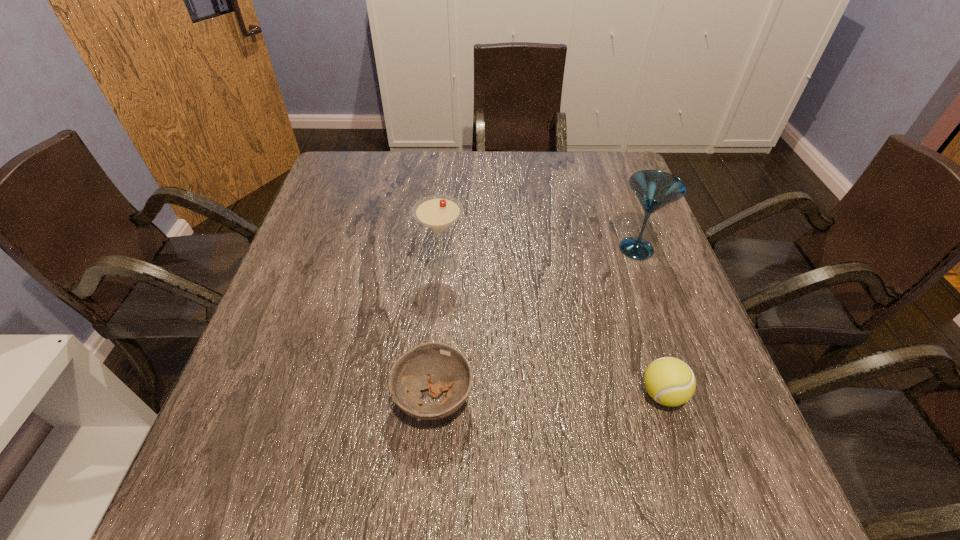
I want to click on free location at the far edge, so click(461, 164).

Where is `free space at the left edge of the desktop`? The height and width of the screenshot is (540, 960). free space at the left edge of the desktop is located at coordinates (324, 205).

You are a GUI agent. You are given a task and a screenshot of the screen. Output one action in this format:
    pyautogui.click(x=<x>, y=<y>)
    Task: Click on the vacant point at the right edge
    This screenshot has width=960, height=540.
    Given the screenshot: What is the action you would take?
    pyautogui.click(x=610, y=205)

At what (x,y) coordinates should I click in order to perform the action: click on vacant space at the far right corner. Please return your answer as a coordinate pair (x, y). This screenshot has width=960, height=540. Looking at the image, I should click on click(597, 154).

What are the coordinates of `vacant area that lies between the right martini and the shortest object` in the screenshot? It's located at (535, 323).

Where is `free space between the third tallest object and the left martini`? This screenshot has width=960, height=540. free space between the third tallest object and the left martini is located at coordinates (553, 330).

Find the location of a particular element. Image resolution: width=960 pixels, height=540 pixels. free spot between the left martini and the bowl is located at coordinates (438, 332).

Locate an element on the screen. The width and height of the screenshot is (960, 540). free spot between the shortest object and the left martini is located at coordinates (438, 332).

Find the location of a particular element. The height and width of the screenshot is (540, 960). vacant space that's between the right martini and the bowl is located at coordinates (535, 323).

Locate an element on the screen. Image resolution: width=960 pixels, height=540 pixels. vacant area that lies between the second shortest object and the right martini is located at coordinates (649, 321).